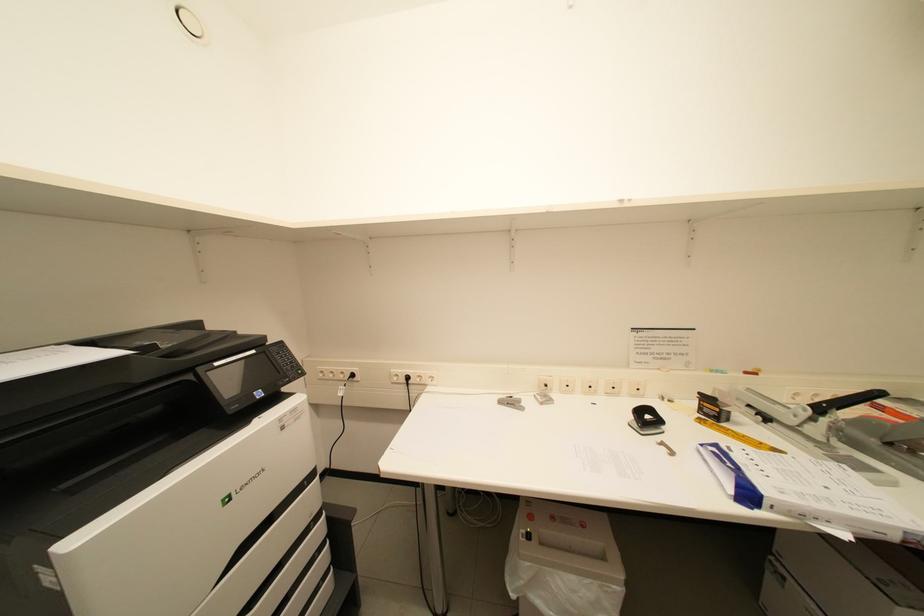
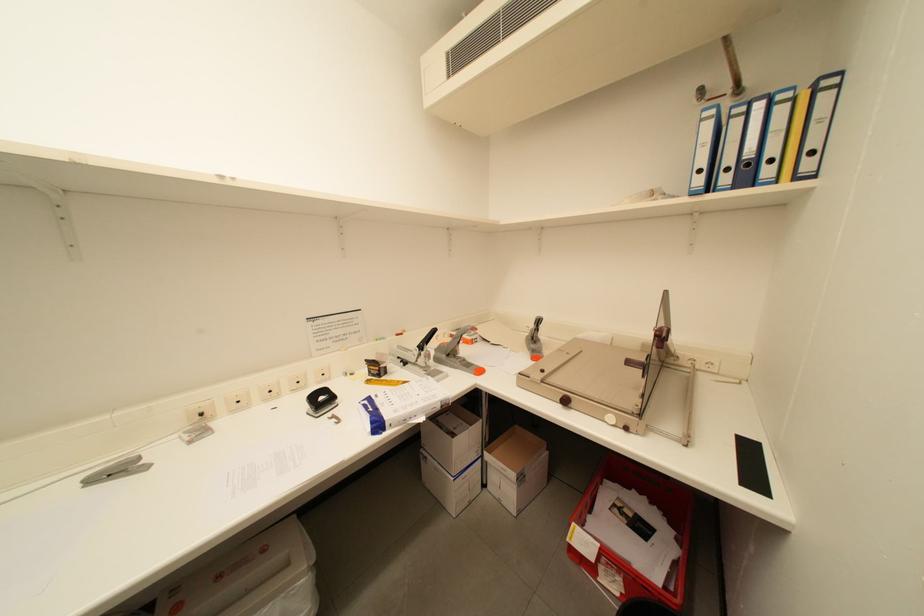
Question: How did the camera likely rotate?

Choices:
 (A) Left
 (B) Right
 (C) Up
 (D) Down

Answer: (B)